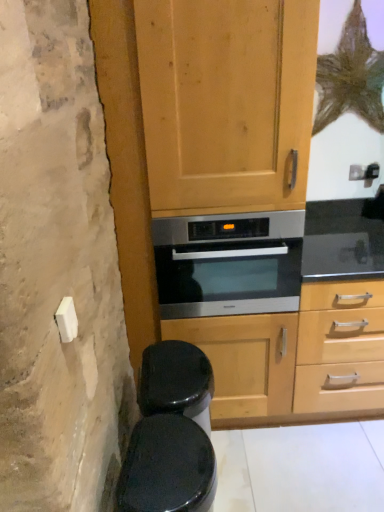
Question: Considering the relative sizes of wooden cabinet at center and black glossy toilet bowl at lower left in the image provided, is wooden cabinet at center taller than black glossy toilet bowl at lower left?

Choices:
 (A) no
 (B) yes

Answer: (B)

Question: Is black glossy toilet bowl at lower left at the back of wooden cabinet at center?

Choices:
 (A) yes
 (B) no

Answer: (B)

Question: Is wooden cabinet at center at the right side of black glossy toilet bowl at lower left?

Choices:
 (A) no
 (B) yes

Answer: (B)

Question: Can you confirm if wooden cabinet at center is wider than black glossy toilet bowl at lower left?

Choices:
 (A) yes
 (B) no

Answer: (A)

Question: Does wooden cabinet at center come in front of black glossy toilet bowl at lower left?

Choices:
 (A) yes
 (B) no

Answer: (B)

Question: From a real-world perspective, does wooden cabinet at center stand above black glossy toilet bowl at lower left?

Choices:
 (A) no
 (B) yes

Answer: (B)

Question: Is stainless steel oven at center turned away from wooden cabinet at center?

Choices:
 (A) no
 (B) yes

Answer: (B)

Question: Is stainless steel oven at center taller than wooden cabinet at center?

Choices:
 (A) yes
 (B) no

Answer: (B)

Question: From the image's perspective, would you say stainless steel oven at center is shown under wooden cabinet at center?

Choices:
 (A) no
 (B) yes

Answer: (B)

Question: From a real-world perspective, is stainless steel oven at center physically above wooden cabinet at center?

Choices:
 (A) no
 (B) yes

Answer: (A)

Question: Can you confirm if stainless steel oven at center is bigger than wooden cabinet at center?

Choices:
 (A) yes
 (B) no

Answer: (B)

Question: Could wooden cabinet at center be considered to be inside stainless steel oven at center?

Choices:
 (A) no
 (B) yes

Answer: (A)

Question: From a real-world perspective, is stainless steel oven at center physically below black glossy toilet bowl at lower left?

Choices:
 (A) no
 (B) yes

Answer: (A)